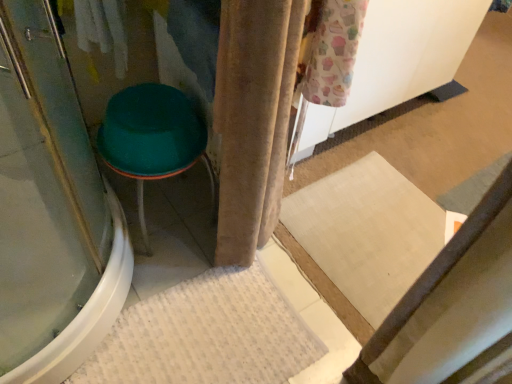
Find the location of `free space between beige velvet curtain at center and green plastic stool at left`. free space between beige velvet curtain at center and green plastic stool at left is located at coordinates (182, 244).